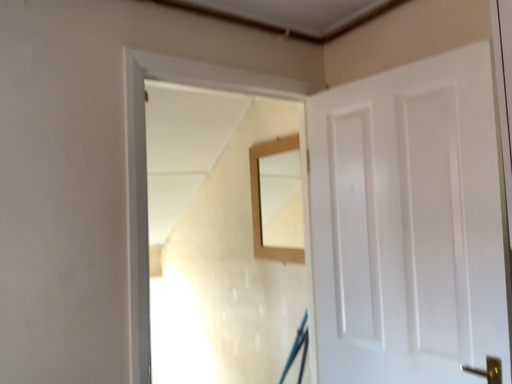
Question: From the image's perspective, is wooden frame at center located beneath white glossy door at right?

Choices:
 (A) no
 (B) yes

Answer: (B)

Question: Is wooden frame at center oriented away from white glossy door at right?

Choices:
 (A) yes
 (B) no

Answer: (B)

Question: Does wooden frame at center have a greater width compared to white glossy door at right?

Choices:
 (A) no
 (B) yes

Answer: (B)

Question: From a real-world perspective, does wooden frame at center sit lower than white glossy door at right?

Choices:
 (A) no
 (B) yes

Answer: (A)

Question: Considering the relative sizes of wooden frame at center and white glossy door at right in the image provided, is wooden frame at center bigger than white glossy door at right?

Choices:
 (A) yes
 (B) no

Answer: (A)

Question: Considering the positions of wooden frame at center and white glossy door at right in the image, is wooden frame at center taller or shorter than white glossy door at right?

Choices:
 (A) tall
 (B) short

Answer: (A)

Question: Considering the positions of point (309, 92) and point (465, 155), is point (309, 92) closer or farther from the camera than point (465, 155)?

Choices:
 (A) farther
 (B) closer

Answer: (A)

Question: From a real-world perspective, is wooden frame at center above or below white glossy door at right?

Choices:
 (A) above
 (B) below

Answer: (A)

Question: Visually, is wooden frame at center positioned to the left or to the right of white glossy door at right?

Choices:
 (A) left
 (B) right

Answer: (A)

Question: Considering the positions of wooden mirror at center and wooden frame at center in the image, is wooden mirror at center bigger or smaller than wooden frame at center?

Choices:
 (A) big
 (B) small

Answer: (B)

Question: Is wooden mirror at center wider or thinner than wooden frame at center?

Choices:
 (A) wide
 (B) thin

Answer: (B)

Question: Considering the positions of wooden mirror at center and wooden frame at center in the image, is wooden mirror at center taller or shorter than wooden frame at center?

Choices:
 (A) tall
 (B) short

Answer: (B)

Question: Is wooden mirror at center situated inside wooden frame at center or outside?

Choices:
 (A) outside
 (B) inside

Answer: (A)

Question: From the image's perspective, is wooden mirror at center located above or below white glossy door at right?

Choices:
 (A) below
 (B) above

Answer: (B)

Question: From a real-world perspective, is wooden mirror at center physically located above or below white glossy door at right?

Choices:
 (A) below
 (B) above

Answer: (B)